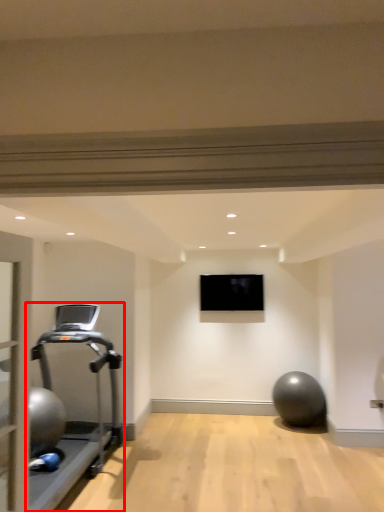
Question: From the image's perspective, what is the correct spatial relationship of treadmill (annotated by the red box) in relation to projection screen?

Choices:
 (A) below
 (B) above

Answer: (A)